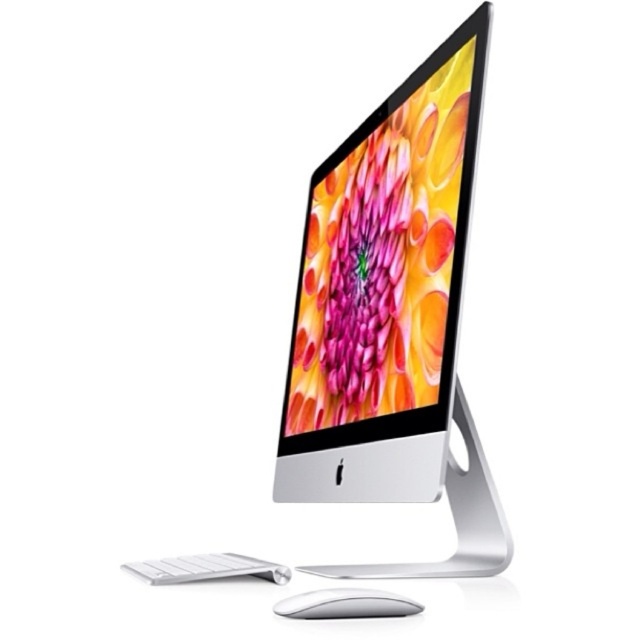
From the picture: Which of these two, silver metallic desktop computer at center or white matte keyboard at lower left, stands taller?

Standing taller between the two is silver metallic desktop computer at center.

Who is lower down, silver metallic desktop computer at center or white matte keyboard at lower left?

white matte keyboard at lower left is lower down.

Measure the distance between point (458, 256) and camera.

Point (458, 256) is 69.35 centimeters away from camera.

This screenshot has height=640, width=640. What are the coordinates of `silver metallic desktop computer at center` in the screenshot? It's located at (392, 317).

In the scene shown: Between silver metallic computer monitor at center and silver metallic mouse at lower center, which one has more height?

Standing taller between the two is silver metallic computer monitor at center.

Between silver metallic computer monitor at center and silver metallic mouse at lower center, which one is positioned lower?

silver metallic mouse at lower center

Does point (368, 198) lie behind point (305, 605)?

Yes, point (368, 198) is farther from viewer.

I want to click on silver metallic computer monitor at center, so click(x=385, y=291).

Can you confirm if white matte keyboard at lower left is positioned below silver metallic mouse at lower center?

Correct, white matte keyboard at lower left is located below silver metallic mouse at lower center.

Does white matte keyboard at lower left appear over silver metallic mouse at lower center?

No.

What do you see at coordinates (205, 568) in the screenshot? I see `white matte keyboard at lower left` at bounding box center [205, 568].

This screenshot has width=640, height=640. In order to click on white matte keyboard at lower left in this screenshot , I will do `click(205, 568)`.